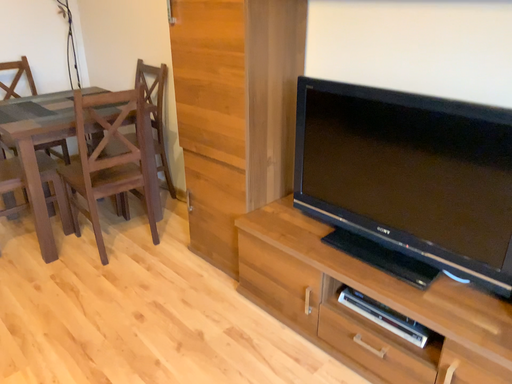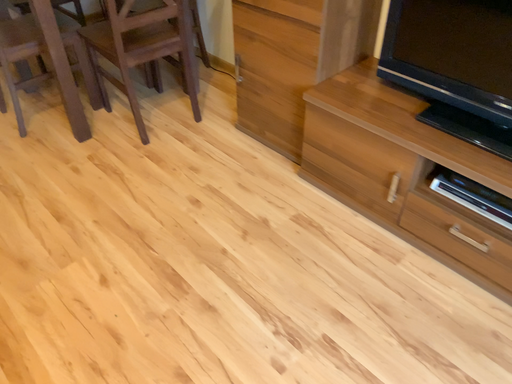
Question: How did the camera likely rotate when shooting the video?

Choices:
 (A) rotated downward
 (B) rotated upward

Answer: (A)